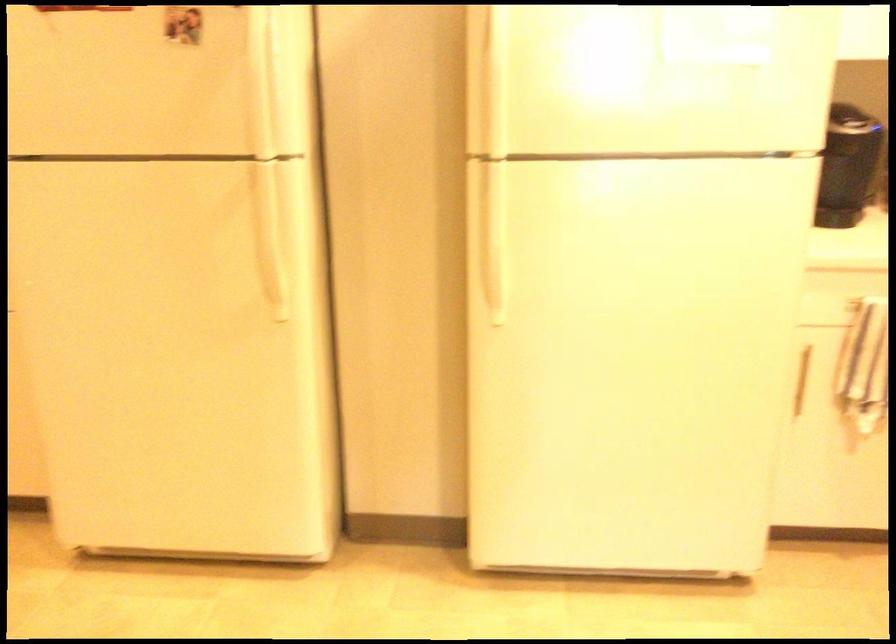
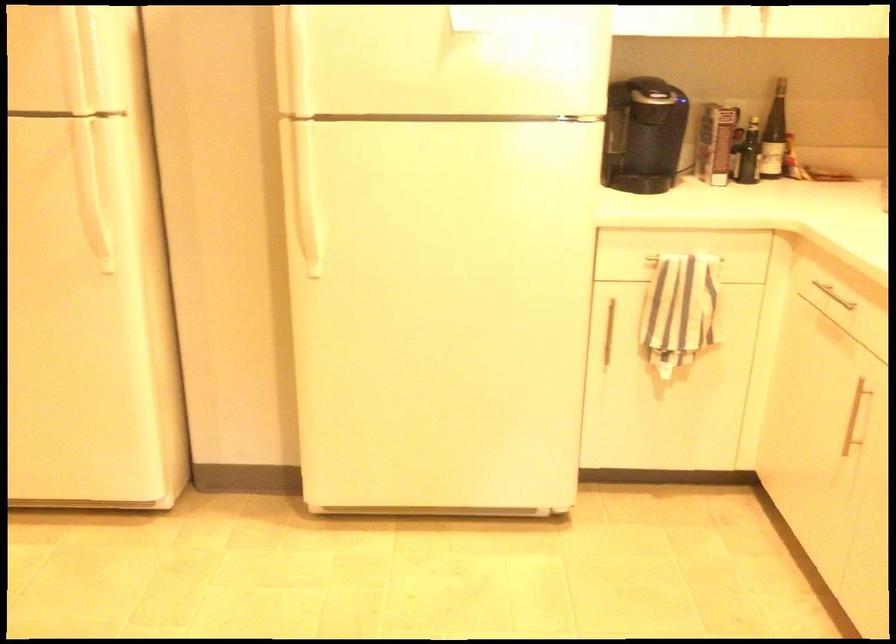
Question: The camera is either moving clockwise (left) or counter-clockwise (right) around the object. The first image is from the beginning of the video and the second image is from the end. Is the camera moving left or right when shooting the video?

Choices:
 (A) Left
 (B) Right

Answer: (A)